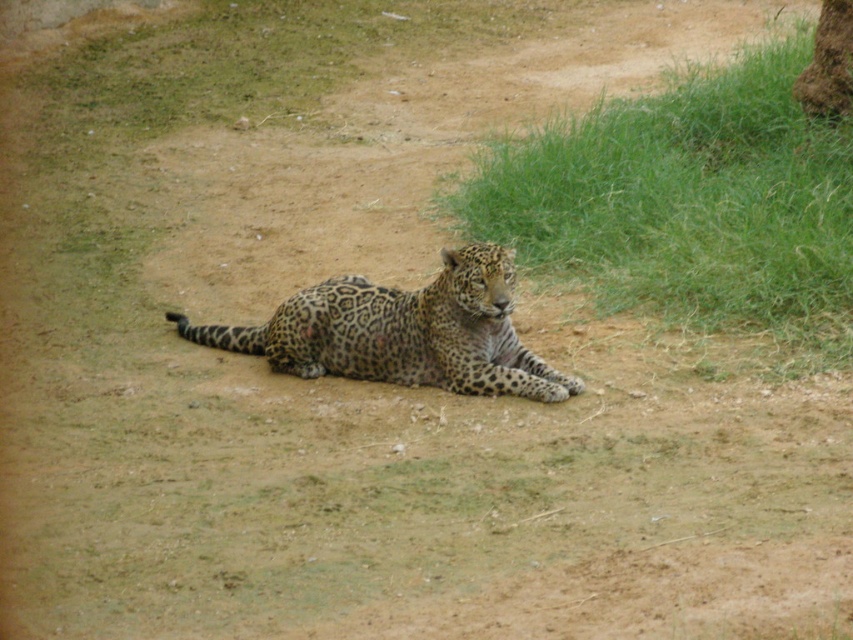
Question: Which point appears closest to the camera in this image?

Choices:
 (A) (503, 209)
 (B) (428, 374)

Answer: (B)

Question: Can you confirm if green grass at center is bigger than spotted fur leopard at center?

Choices:
 (A) yes
 (B) no

Answer: (A)

Question: Among these objects, which one is nearest to the camera?

Choices:
 (A) green grass at center
 (B) spotted fur leopard at center

Answer: (B)

Question: Is green grass at center to the right of spotted fur leopard at center from the viewer's perspective?

Choices:
 (A) no
 (B) yes

Answer: (B)

Question: Which of the following is the closest to the observer?

Choices:
 (A) (751, 124)
 (B) (454, 388)

Answer: (B)

Question: Can you confirm if green grass at center is thinner than spotted fur leopard at center?

Choices:
 (A) no
 (B) yes

Answer: (A)